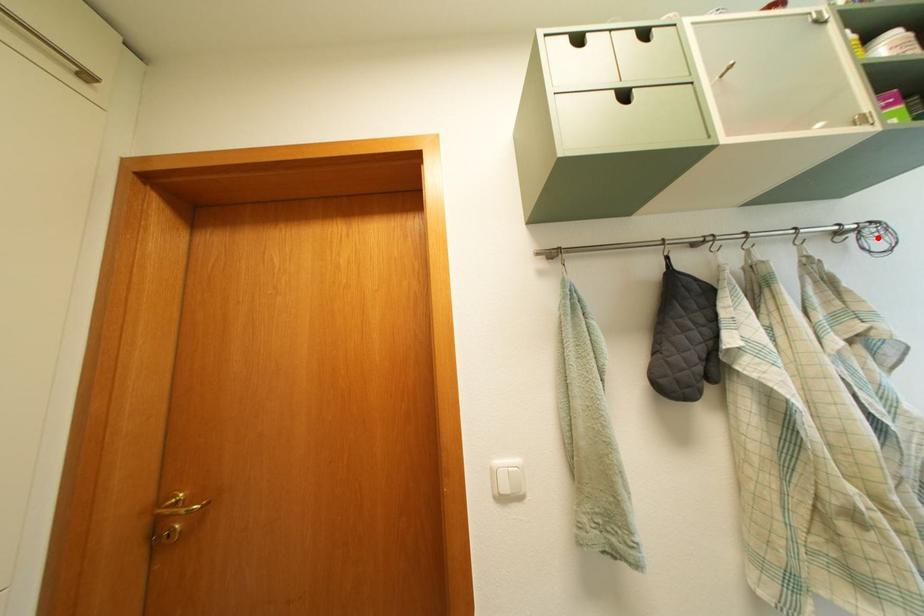
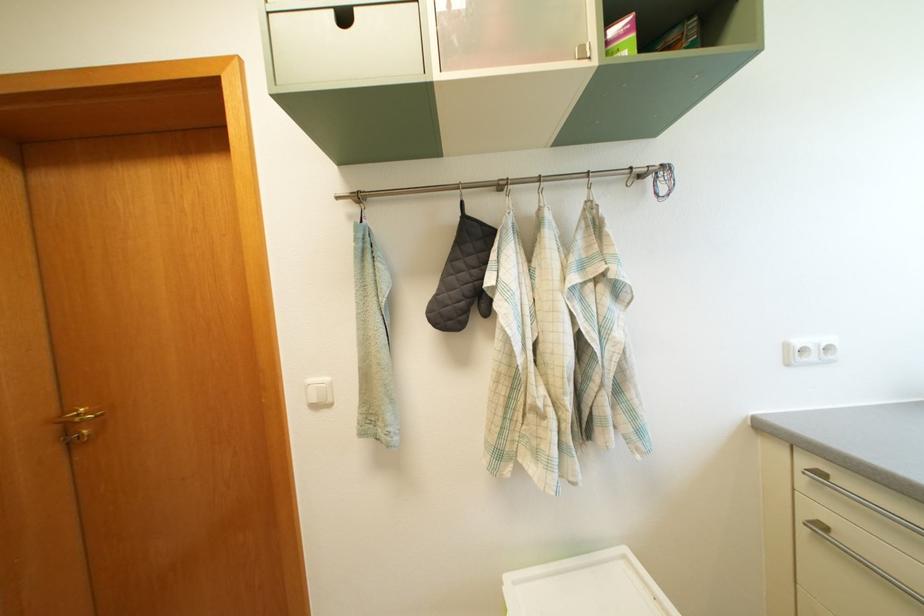
Find the pixel in the second image that matches the highlighted location in the first image.

(669, 180)